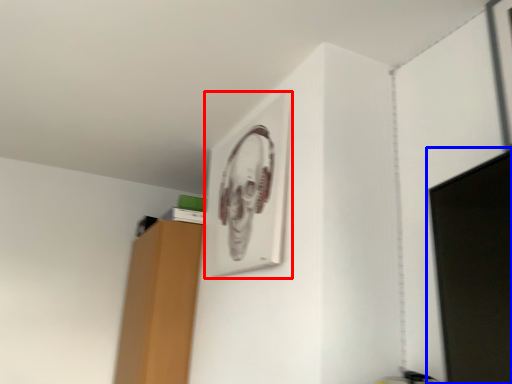
Question: Which point is further to the camera, picture frame (highlighted by a red box) or computer monitor (highlighted by a blue box)?

Choices:
 (A) picture frame
 (B) computer monitor

Answer: (A)